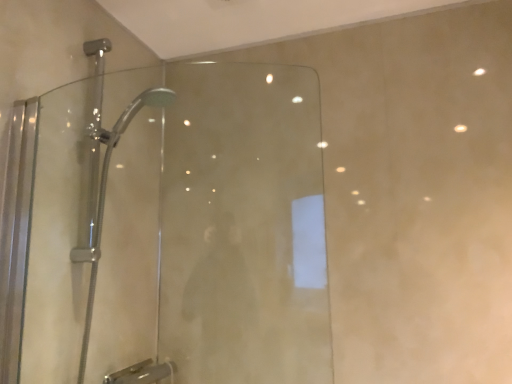
Measure the distance between transparent glass shower door at center and camera.

The distance of transparent glass shower door at center from camera is 37.90 inches.

Find the location of a particular element. The height and width of the screenshot is (384, 512). transparent glass shower door at center is located at coordinates (181, 230).

The width and height of the screenshot is (512, 384). What do you see at coordinates (181, 230) in the screenshot?
I see `transparent glass shower door at center` at bounding box center [181, 230].

This screenshot has width=512, height=384. Find the location of `transparent glass shower door at center`. transparent glass shower door at center is located at coordinates (181, 230).